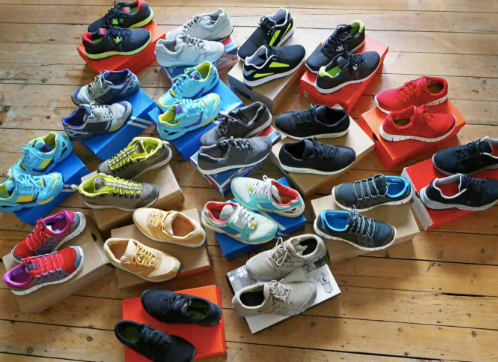
What are the coordinates of `pairs of shoes on a tan box` in the screenshot? It's located at (76, 249), (120, 194), (160, 245), (312, 147), (369, 222).